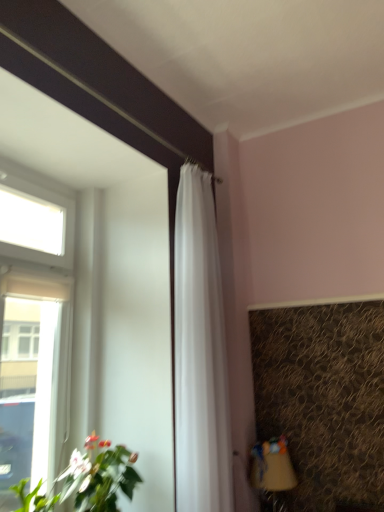
Question: From a real-world perspective, does transparent glass window at upper left stand above matte brown table lamp at lower right?

Choices:
 (A) no
 (B) yes

Answer: (B)

Question: From a real-world perspective, is transparent glass window at upper left positioned under matte brown table lamp at lower right based on gravity?

Choices:
 (A) yes
 (B) no

Answer: (B)

Question: Considering the relative sizes of transparent glass window at upper left and matte brown table lamp at lower right in the image provided, is transparent glass window at upper left bigger than matte brown table lamp at lower right?

Choices:
 (A) no
 (B) yes

Answer: (B)

Question: From the image's perspective, is transparent glass window at upper left on top of matte brown table lamp at lower right?

Choices:
 (A) yes
 (B) no

Answer: (A)

Question: Is transparent glass window at upper left facing towards matte brown table lamp at lower right?

Choices:
 (A) yes
 (B) no

Answer: (B)

Question: From their relative heights in the image, would you say transparent glass window at upper left is taller or shorter than green leafy plant at lower left?

Choices:
 (A) tall
 (B) short

Answer: (A)

Question: Is transparent glass window at upper left in front of or behind green leafy plant at lower left in the image?

Choices:
 (A) front
 (B) behind

Answer: (B)

Question: From the image's perspective, relative to green leafy plant at lower left, is transparent glass window at upper left above or below?

Choices:
 (A) above
 (B) below

Answer: (A)

Question: In terms of width, does transparent glass window at upper left look wider or thinner when compared to green leafy plant at lower left?

Choices:
 (A) wide
 (B) thin

Answer: (B)

Question: From a real-world perspective, relative to transparent glass window at upper left, is white sheer curtain at center vertically above or below?

Choices:
 (A) above
 (B) below

Answer: (A)

Question: Looking at their shapes, would you say white sheer curtain at center is wider or thinner than transparent glass window at upper left?

Choices:
 (A) thin
 (B) wide

Answer: (A)

Question: From their relative heights in the image, would you say white sheer curtain at center is taller or shorter than transparent glass window at upper left?

Choices:
 (A) short
 (B) tall

Answer: (B)

Question: In terms of size, does white sheer curtain at center appear bigger or smaller than transparent glass window at upper left?

Choices:
 (A) big
 (B) small

Answer: (B)

Question: From the image's perspective, is matte brown table lamp at lower right positioned above or below transparent glass window at upper left?

Choices:
 (A) below
 (B) above

Answer: (A)

Question: Is matte brown table lamp at lower right in front of or behind transparent glass window at upper left in the image?

Choices:
 (A) front
 (B) behind

Answer: (B)